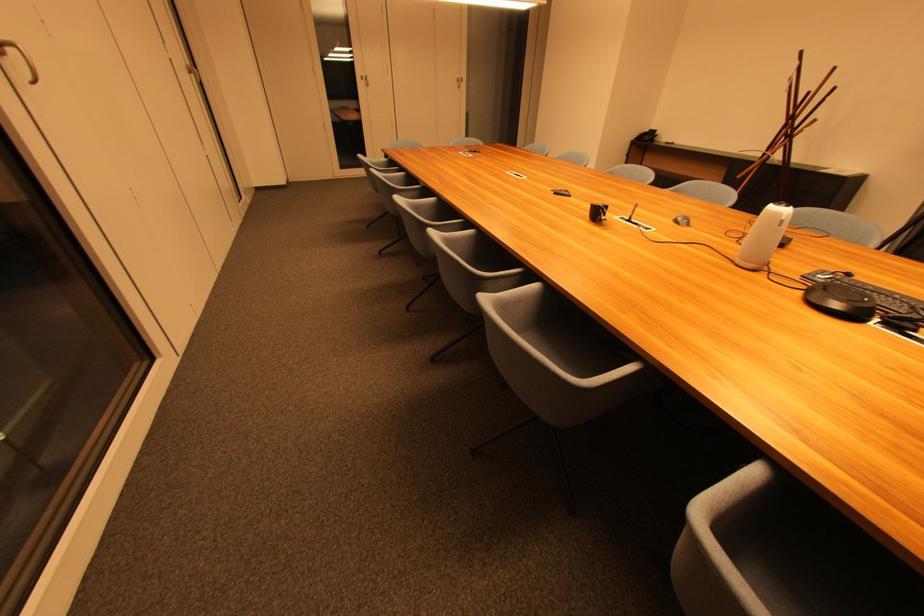
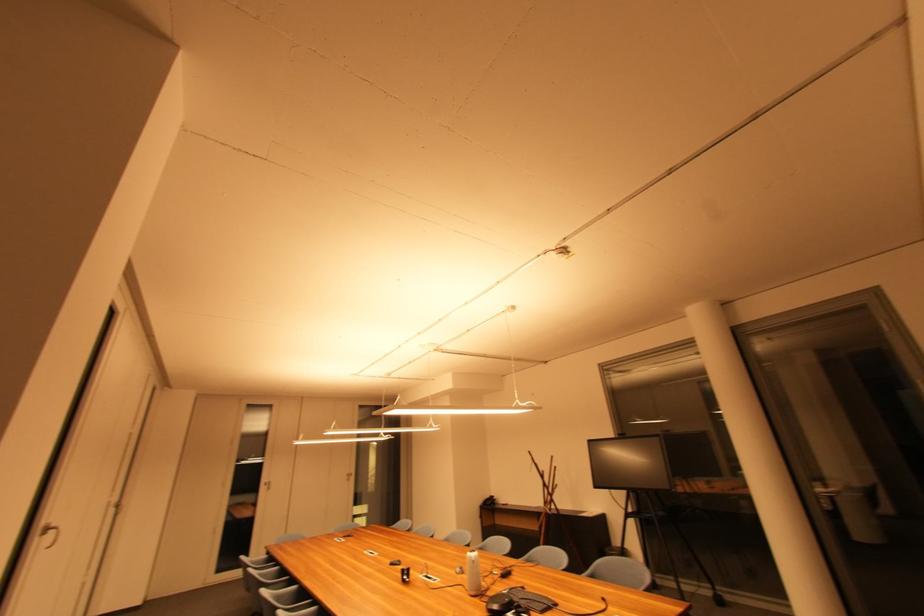
Locate, in the second image, the point that corresponds to pixel 784 216 in the first image.

(477, 560)